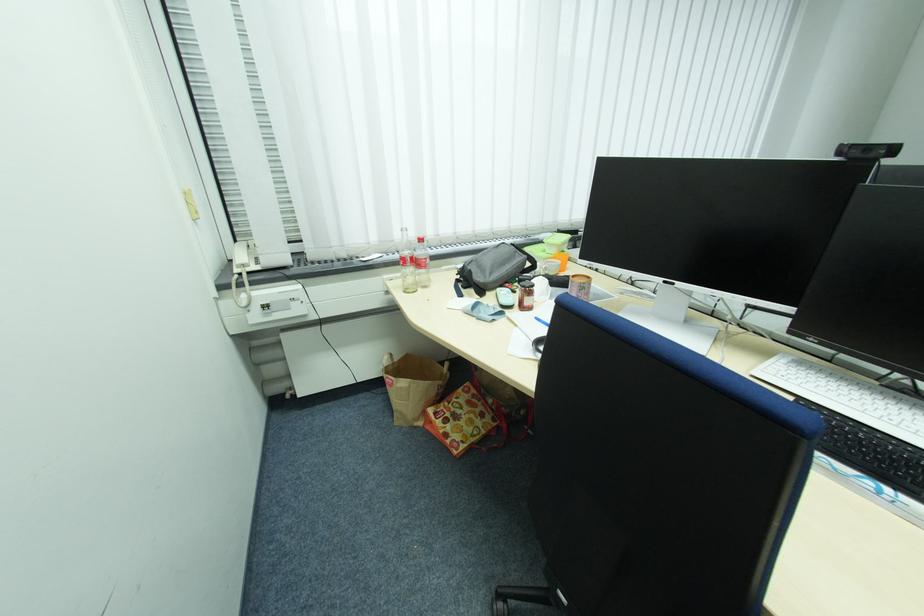
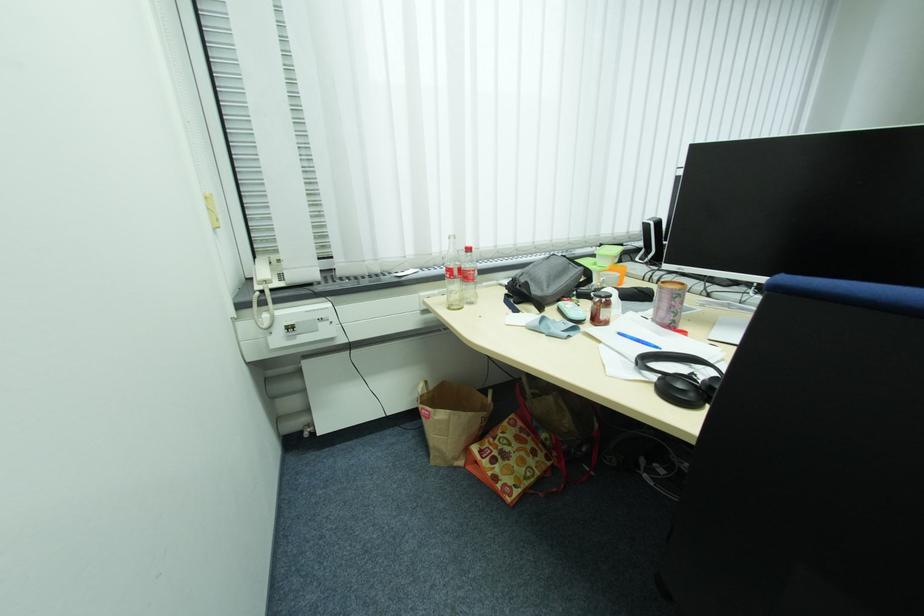
What movement of the cameraman would produce the second image?

The cameraman moved toward left, forward.